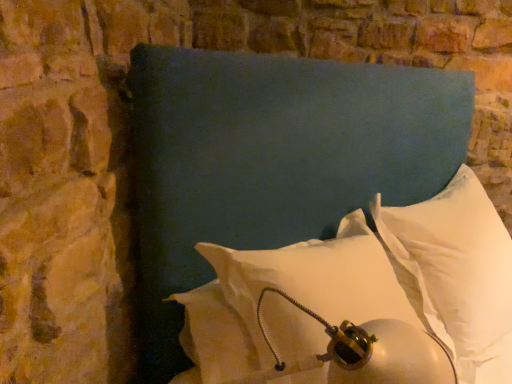
Question: In the image, is white soft pillow at center, arranged as the 2th pillow when viewed from the left, positioned in front of or behind white soft pillow at lower right, the 3th pillow from the right?

Choices:
 (A) front
 (B) behind

Answer: (A)

Question: Is white soft pillow at center, arranged as the 2th pillow when viewed from the left, taller or shorter than white soft pillow at lower right, the 3th pillow from the right?

Choices:
 (A) tall
 (B) short

Answer: (A)

Question: Which object is the closest to the white soft pillow at center, the second pillow from the right?

Choices:
 (A) white soft pillow at center, which is the 1th pillow in right-to-left order
 (B) white soft pillow at lower right, the 3th pillow from the right

Answer: (B)

Question: Which object is the farthest from the white soft pillow at center, which is the 1th pillow in right-to-left order?

Choices:
 (A) white soft pillow at lower right, placed as the first pillow when sorted from left to right
 (B) white soft pillow at center, arranged as the 2th pillow when viewed from the left

Answer: (A)